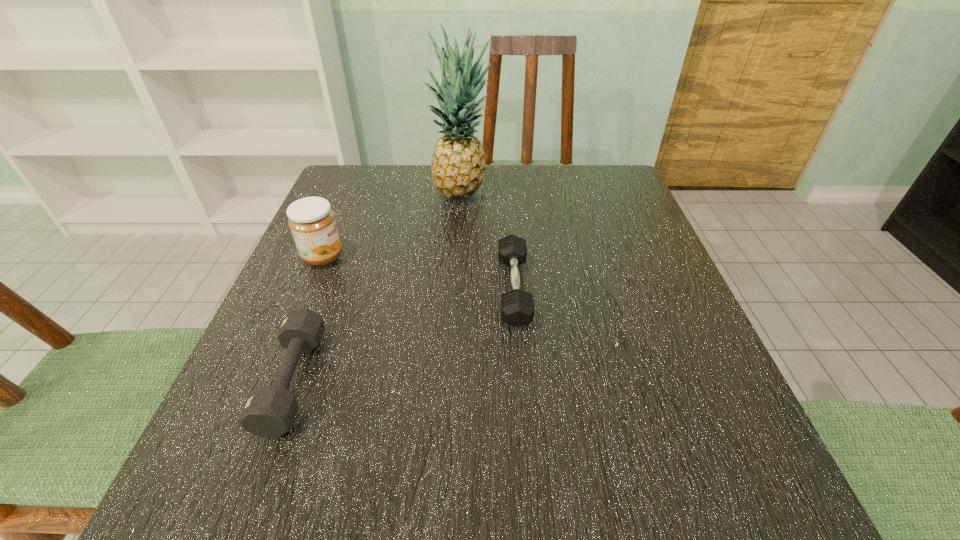
Where is `vacant position in the image that satisfies the following two spatial constraints: 1. on the front label of the left dumbbell; 2. on the right side of the third shortest object`? Image resolution: width=960 pixels, height=540 pixels. vacant position in the image that satisfies the following two spatial constraints: 1. on the front label of the left dumbbell; 2. on the right side of the third shortest object is located at coordinates (272, 380).

This screenshot has width=960, height=540. What are the coordinates of `free point that satisfies the following two spatial constraints: 1. on the front label of the farther dumbbell; 2. on the right side of the jam` in the screenshot? It's located at (309, 289).

Locate an element on the screen. vacant region that satisfies the following two spatial constraints: 1. on the front label of the jam; 2. on the back side of the nearer dumbbell is located at coordinates (272, 380).

Identify the location of free space that satisfies the following two spatial constraints: 1. on the front label of the second tallest object; 2. on the right side of the right dumbbell. Image resolution: width=960 pixels, height=540 pixels. (309, 289).

This screenshot has width=960, height=540. What are the coordinates of `free space that satisfies the following two spatial constraints: 1. on the front label of the second tallest object; 2. on the left side of the left dumbbell` in the screenshot? It's located at tap(272, 380).

The width and height of the screenshot is (960, 540). What are the coordinates of `free space that satisfies the following two spatial constraints: 1. on the back side of the nearer dumbbell; 2. on the front label of the jam` in the screenshot? It's located at (339, 257).

This screenshot has height=540, width=960. Find the location of `blank space that satisfies the following two spatial constraints: 1. on the front side of the farthest object; 2. on the front label of the third shortest object`. blank space that satisfies the following two spatial constraints: 1. on the front side of the farthest object; 2. on the front label of the third shortest object is located at coordinates (458, 257).

Locate an element on the screen. vacant point that satisfies the following two spatial constraints: 1. on the front label of the third shortest object; 2. on the right side of the left dumbbell is located at coordinates (272, 380).